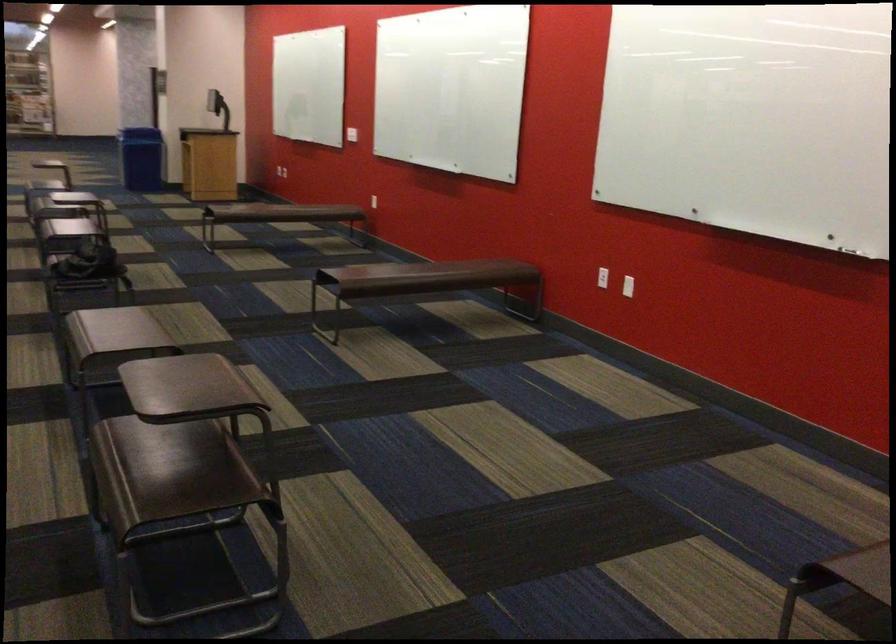
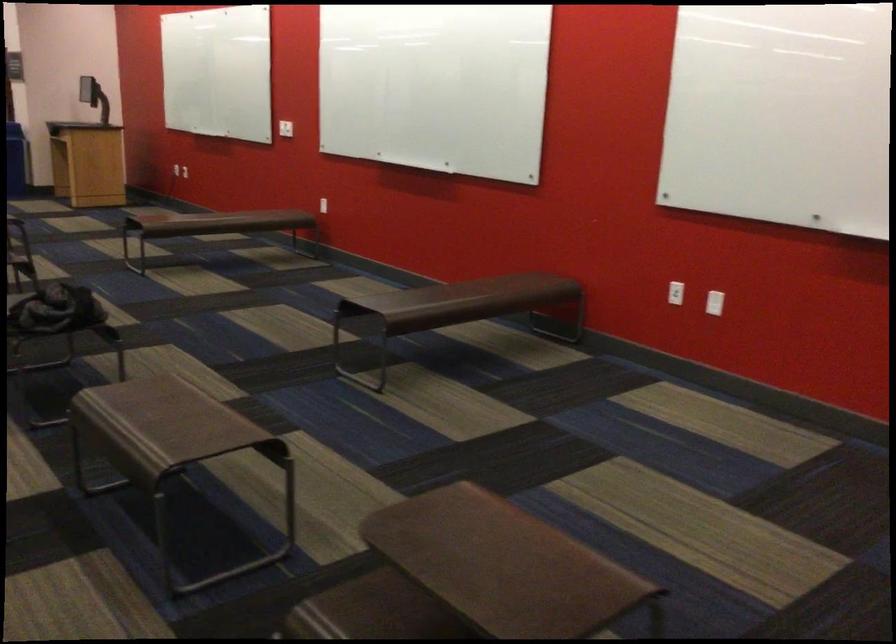
Locate, in the second image, the point that corresponds to [93,263] in the first image.

(56, 310)